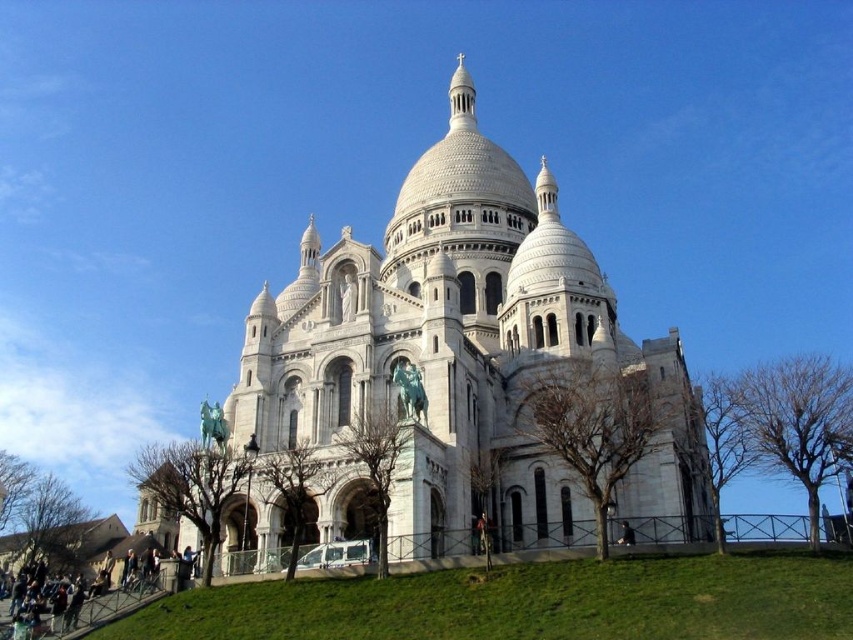
You are standing on the Montmartre hill, and you want to take a photo of the white stone church at center. If your camera can focus on objects up to 50 meters away, will it be able to capture the church clearly?

The white stone church at center is 50.77 meters away from the viewer. Since the camera can focus up to 50 meters, it will not be able to capture the church clearly as it is slightly beyond the maximum focusing distance.

You are standing at the base of the Montmartre hill looking up at the white stone church at center and the green grass at lower center. Which object is closer to you?

The green grass at lower center is closer to you because it is positioned in front of the white stone church at center, which is further away.